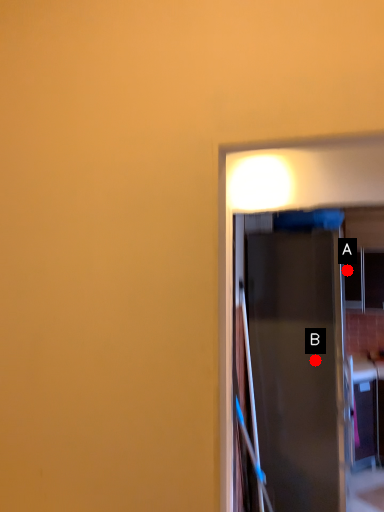
Question: Two points are circled on the image, labeled by A and B beside each circle. Which point is farther from the camera taking this photo?

Choices:
 (A) A is further
 (B) B is further

Answer: (A)